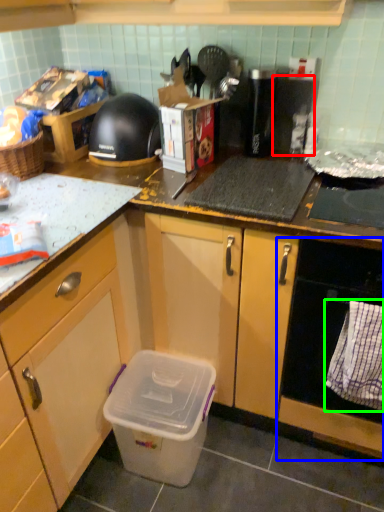
Question: Which object is positioned closest to appliance (highlighted by a red box)? Select from oven (highlighted by a blue box) and cloth (highlighted by a green box).

Choices:
 (A) oven
 (B) cloth

Answer: (A)